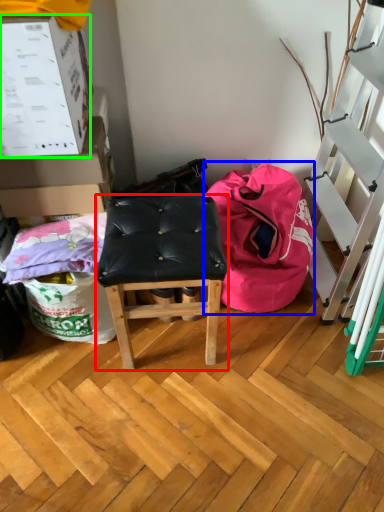
Question: Considering the real-world distances, which object is farthest from stool (highlighted by a red box)? bean bag chair (highlighted by a blue box) or box (highlighted by a green box)?

Choices:
 (A) bean bag chair
 (B) box

Answer: (B)